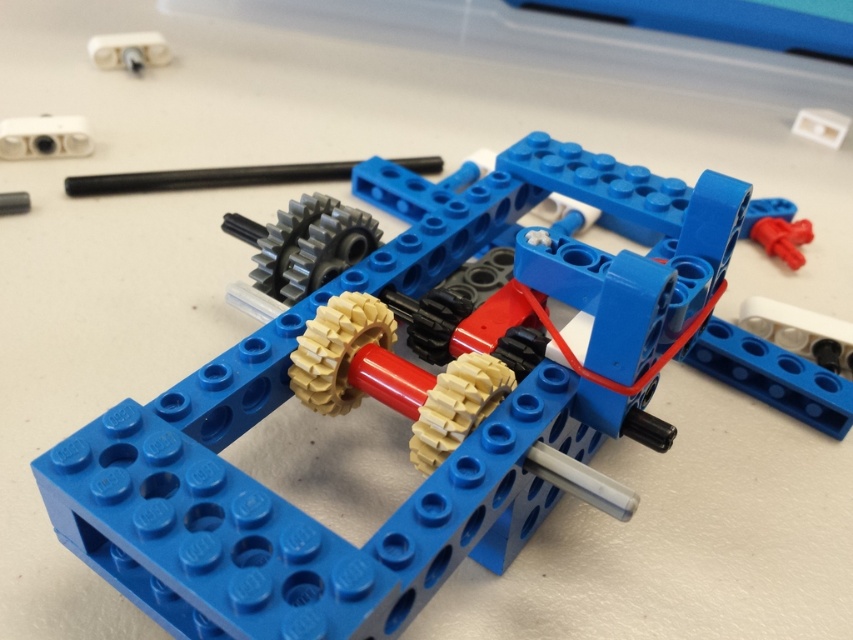
You are examining a LEGO model and notice two points marked on the image. The first point is at coordinates point (x=78, y=152) and the second is at point (x=137, y=45). Which of these points is nearer to you as you look at the model?

Point (x=78, y=152) is closer to the viewer than point (x=137, y=45).

You are an engineer designing a LEGO model and need to choose between the white plastic connector at upper left and the white plastic hinge at upper right for a part that requires a wider component. Which one should you select?

The white plastic connector at upper left should be selected because its width is larger than the white plastic hinge at upper right.